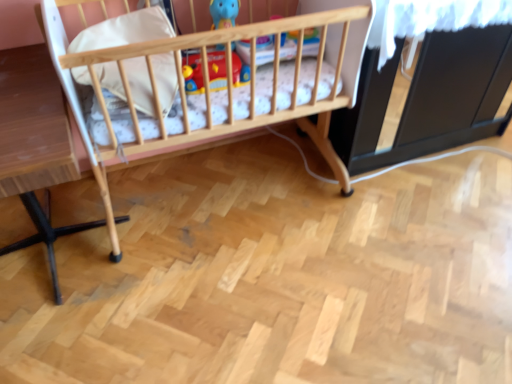
Question: Is wooden crib at center surrounded by light brown wooden table at left?

Choices:
 (A) no
 (B) yes

Answer: (A)

Question: Does light brown wooden table at left have a lesser height compared to wooden crib at center?

Choices:
 (A) yes
 (B) no

Answer: (A)

Question: Is light brown wooden table at left oriented towards wooden crib at center?

Choices:
 (A) yes
 (B) no

Answer: (B)

Question: From the image's perspective, does light brown wooden table at left appear lower than wooden crib at center?

Choices:
 (A) yes
 (B) no

Answer: (A)

Question: From a real-world perspective, is light brown wooden table at left beneath wooden crib at center?

Choices:
 (A) yes
 (B) no

Answer: (A)

Question: In terms of width, does wooden crib at center look wider or thinner when compared to matte plastic toy at center?

Choices:
 (A) wide
 (B) thin

Answer: (A)

Question: From a real-world perspective, is wooden crib at center physically located above or below matte plastic toy at center?

Choices:
 (A) below
 (B) above

Answer: (A)

Question: From the image's perspective, is wooden crib at center positioned above or below matte plastic toy at center?

Choices:
 (A) below
 (B) above

Answer: (A)

Question: In terms of height, does wooden crib at center look taller or shorter compared to matte plastic toy at center?

Choices:
 (A) short
 (B) tall

Answer: (B)

Question: Is wooden crib at center in front of or behind white soft pillow at upper left in the image?

Choices:
 (A) behind
 (B) front

Answer: (B)

Question: Is wooden crib at center wider or thinner than white soft pillow at upper left?

Choices:
 (A) wide
 (B) thin

Answer: (A)

Question: Is point (138, 122) positioned closer to the camera than point (148, 96)?

Choices:
 (A) farther
 (B) closer

Answer: (A)

Question: Is wooden crib at center to the left or to the right of white soft pillow at upper left in the image?

Choices:
 (A) left
 (B) right

Answer: (B)

Question: Would you say matte plastic toy at center is to the left or to the right of light brown wooden table at left in the picture?

Choices:
 (A) left
 (B) right

Answer: (B)

Question: From a real-world perspective, relative to light brown wooden table at left, is matte plastic toy at center vertically above or below?

Choices:
 (A) below
 (B) above

Answer: (B)